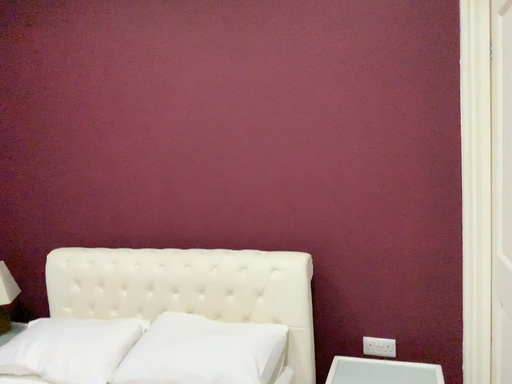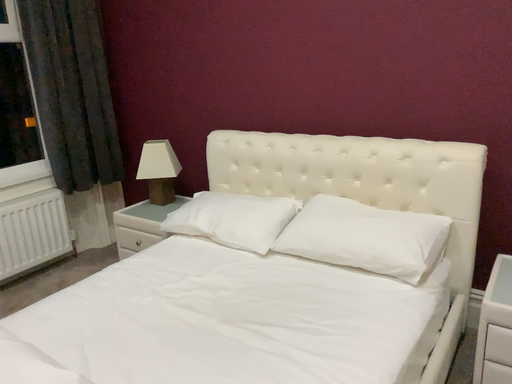
Question: Which way did the camera rotate in the video?

Choices:
 (A) rotated downward
 (B) rotated upward

Answer: (A)